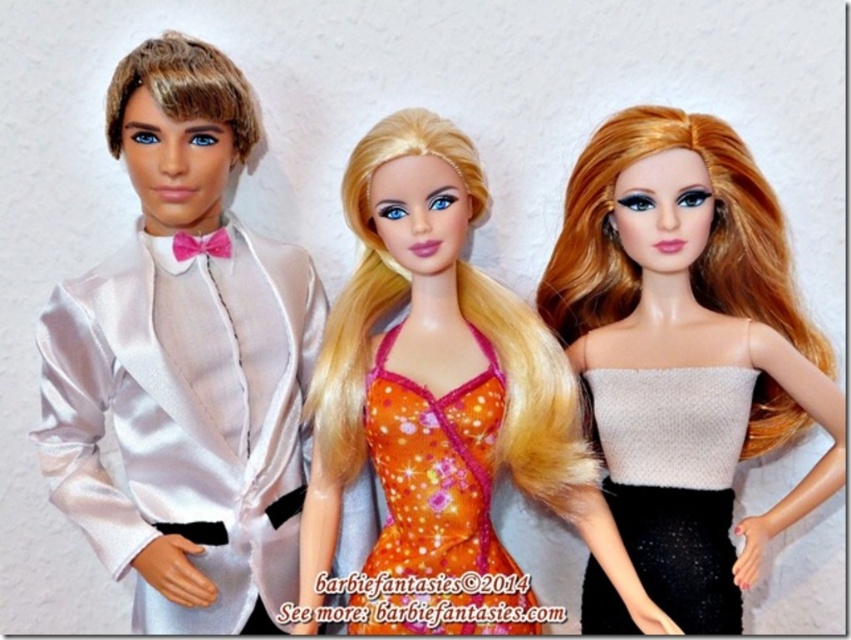
Question: Is satin white tuxedo at left above orange satin cocktail dress at center?

Choices:
 (A) no
 (B) yes

Answer: (B)

Question: Can you confirm if white textured sweater at center is positioned to the left of orange satin cocktail dress at center?

Choices:
 (A) no
 (B) yes

Answer: (A)

Question: Where is satin white tuxedo at left located in relation to shiny silver dress at center in the image?

Choices:
 (A) above
 (B) below

Answer: (A)

Question: Which of the following is the farthest from the observer?

Choices:
 (A) (187, 456)
 (B) (370, 632)

Answer: (A)

Question: Among these objects, which one is farthest from the camera?

Choices:
 (A) white textured sweater at center
 (B) satin white tuxedo at left
 (C) shiny silver dress at center
 (D) orange satin cocktail dress at center

Answer: (B)

Question: Which point is farther to the camera?

Choices:
 (A) (380, 371)
 (B) (692, 380)

Answer: (A)